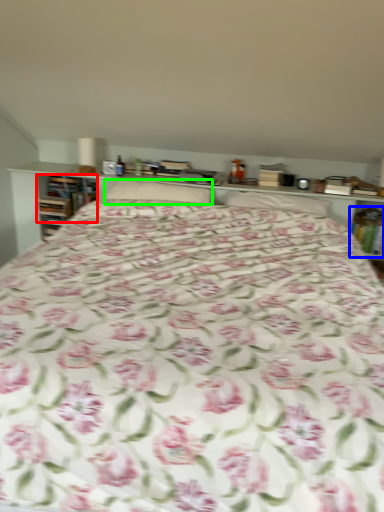
Question: Which is farther away from book (highlighted by a red box)? book (highlighted by a blue box) or pillow (highlighted by a green box)?

Choices:
 (A) book
 (B) pillow

Answer: (A)